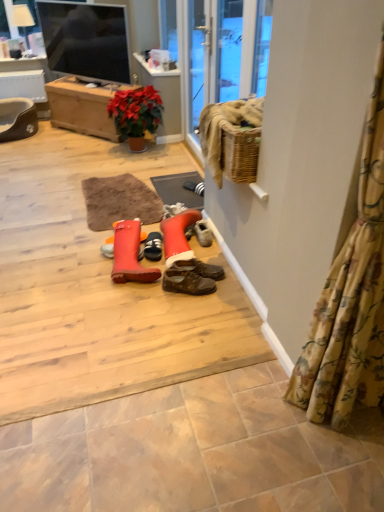
Image resolution: width=384 pixels, height=512 pixels. Identify the location of free space above matte beige tile at lower center (from a real-world perspective). (201, 450).